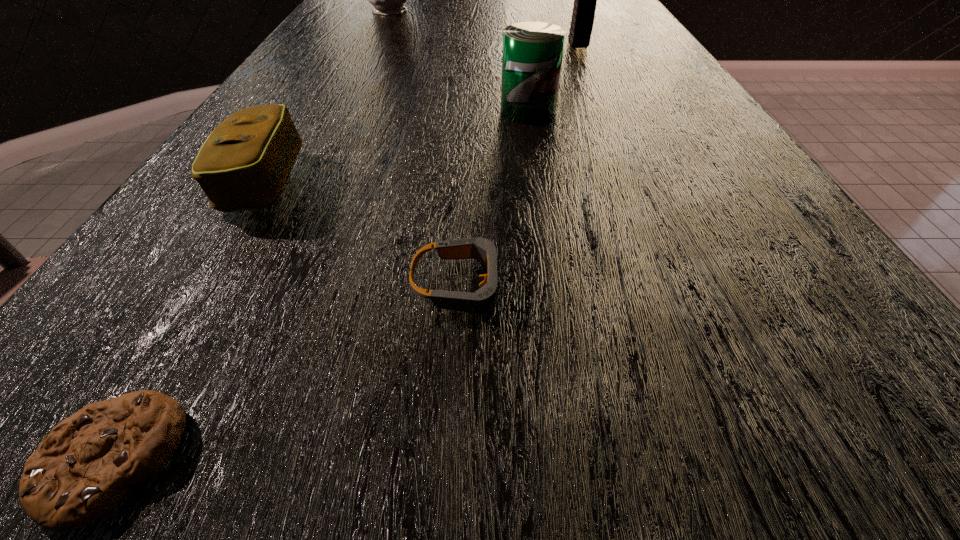
Locate an element on the screen. free space located 0.250m with the zip open on the taller clutch bag is located at coordinates (601, 97).

You are a GUI agent. You are given a task and a screenshot of the screen. Output one action in this format:
    pyautogui.click(x=<x>, y=<y>)
    Task: Click on the free point located 0.070m on the front of the can
    The height and width of the screenshot is (540, 960).
    Given the screenshot: What is the action you would take?
    pyautogui.click(x=534, y=144)

The width and height of the screenshot is (960, 540). I want to click on free region located on the zipper side of the nearer clutch bag, so click(x=348, y=182).

I want to click on vacant space located on the front and back of the fourth object from left to right, so click(x=613, y=285).

Where is `object present at the far edge`? object present at the far edge is located at coordinates (387, 0).

Identify the location of chinaware present at the left edge. (387, 0).

At what (x,y) coordinates should I click in order to perform the action: click on clutch bag present at the left edge. Please return your answer as a coordinate pair (x, y). Looking at the image, I should click on (244, 164).

This screenshot has height=540, width=960. What are the coordinates of `object that is at the far left corner` in the screenshot? It's located at (387, 0).

In order to click on free point at the far edge in this screenshot , I will do `click(479, 12)`.

Find the location of a particular element. The height and width of the screenshot is (540, 960). free space at the near edge of the desktop is located at coordinates (304, 513).